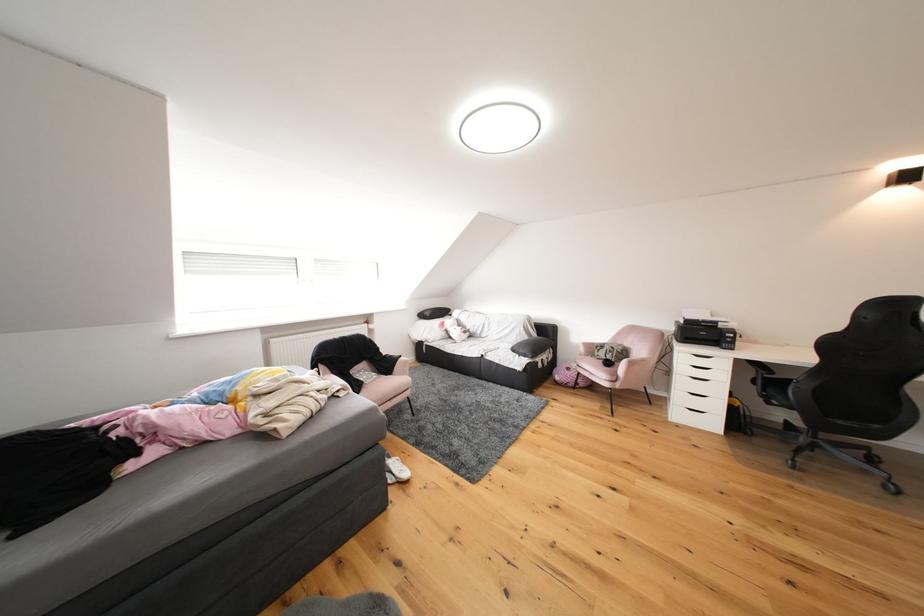
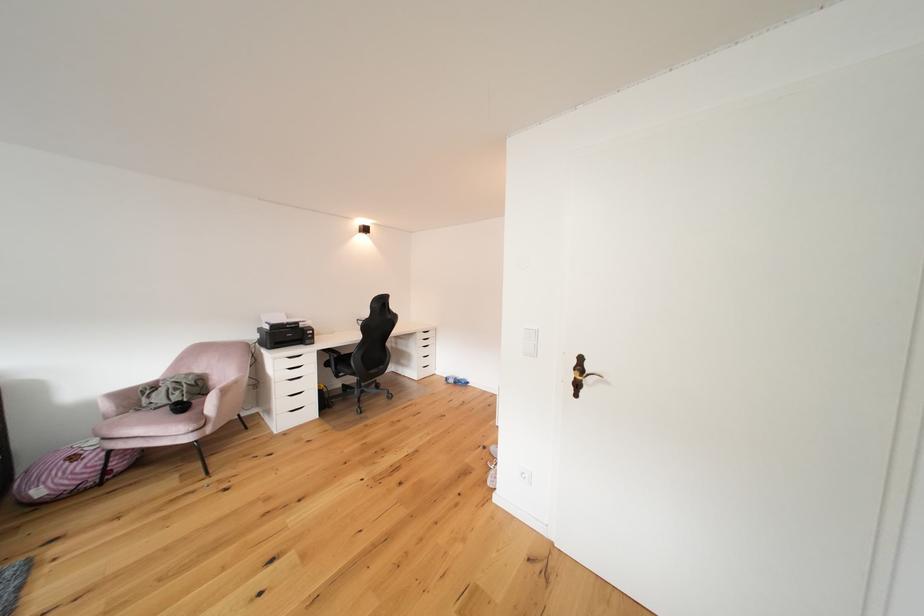
In the second image, find the point that corresponds to [713,325] in the first image.

(298, 328)